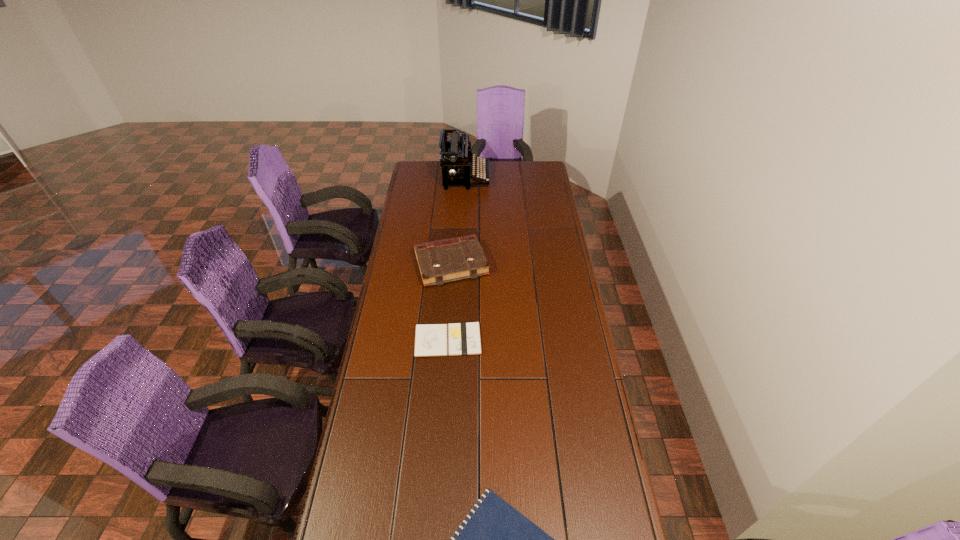
This screenshot has width=960, height=540. I want to click on free space that satisfies the following two spatial constraints: 1. on the front side of the third nearest object; 2. on the right side of the farther notepad, so click(446, 340).